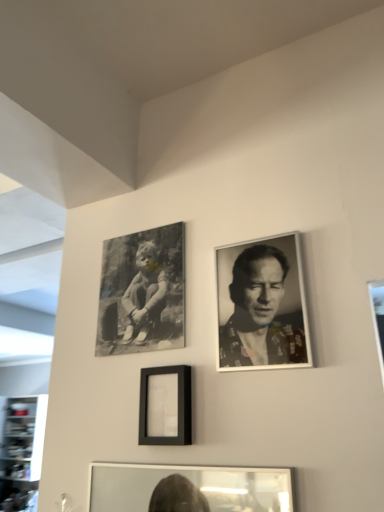
Measure the distance between point (x=122, y=298) and camera.

A distance of 1.21 meters exists between point (x=122, y=298) and camera.

What is the approximate width of black matte canvas at upper left, the 2th picture frame in the bottom-to-top sequence?

It is 1.17 inches.

You are a GUI agent. You are given a task and a screenshot of the screen. Output one action in this format:
    pyautogui.click(x=<x>, y=<y>)
    Task: Click on the black and white portrait at upper right
    
    Given the screenshot: What is the action you would take?
    pyautogui.click(x=259, y=313)

Could you measure the distance between black matte canvas at upper left, the 2th picture frame in the bottom-to-top sequence, and black and white portrait at upper right?

black matte canvas at upper left, the 2th picture frame in the bottom-to-top sequence, and black and white portrait at upper right are 9.85 inches apart.

Starting from the black and white portrait at upper right, which picture frame is the 2nd one to the left? Please provide its 2D coordinates.

[(142, 292)]

Consider the image. Is black matte canvas at upper left, the 2th picture frame in the bottom-to-top sequence, oriented towards black and white portrait at upper right?

No, black matte canvas at upper left, the 2th picture frame in the bottom-to-top sequence, is not aimed at black and white portrait at upper right.

From the image's perspective, is black matte canvas at upper left, the 2th picture frame in the bottom-to-top sequence, below black and white portrait at upper right?

Actually, black matte canvas at upper left, the 2th picture frame in the bottom-to-top sequence, appears above black and white portrait at upper right in the image.

Which picture frame is the 2nd one when counting from the back of the black and white portrait at upper right? Please provide its 2D coordinates.

[(142, 292)]

Is black and white portrait at upper right aimed at black matte canvas at upper left, the first picture frame in the back-to-front sequence?

No, black and white portrait at upper right is not oriented towards black matte canvas at upper left, the first picture frame in the back-to-front sequence.

In the scene shown: Can you tell me how much black and white portrait at upper right and black matte canvas at upper left, the 2th picture frame in the bottom-to-top sequence, differ in facing direction?

0.966 degrees.

Is black and white portrait at upper right with black matte canvas at upper left, the second picture frame viewed from the front?

No, black and white portrait at upper right is not with black matte canvas at upper left, the second picture frame viewed from the front.

Is matte black frame at center, the first picture frame positioned from the bottom, in contact with black and white portrait at upper right?

There is a gap between matte black frame at center, the first picture frame positioned from the bottom, and black and white portrait at upper right.

Is matte black frame at center, the first picture frame positioned from the bottom, aimed at black and white portrait at upper right?

No, matte black frame at center, the first picture frame positioned from the bottom, does not turn towards black and white portrait at upper right.

Does matte black frame at center, placed as the 2th picture frame when sorted from top to bottom, have a smaller size compared to black and white portrait at upper right?

Yes.

Find the location of a particular element. picture frame located above the matte black frame at center, the first picture frame when ordered from front to back (from the image's perspective) is located at coordinates (142, 292).

Looking at this image, between black matte canvas at upper left, the second picture frame viewed from the front, and matte black frame at center, the first picture frame positioned from the bottom, which one has more height?

black matte canvas at upper left, the second picture frame viewed from the front, is taller.

Is point (103, 246) farther from camera compared to point (178, 434)?

Yes, point (103, 246) is farther from viewer.

From the image's perspective, between black matte canvas at upper left, which appears as the 1th picture frame when viewed from the top, and matte black frame at center, the first picture frame when ordered from front to back, who is located below?

From the image's view, matte black frame at center, the first picture frame when ordered from front to back, is below.

Could you tell me if black and white portrait at upper right is facing matte black frame at center, the first picture frame positioned from the bottom?

No, black and white portrait at upper right is not facing towards matte black frame at center, the first picture frame positioned from the bottom.

How far apart are black and white portrait at upper right and matte black frame at center, the first picture frame when ordered from front to back?

The distance of black and white portrait at upper right from matte black frame at center, the first picture frame when ordered from front to back, is 8.61 inches.

In terms of size, does black and white portrait at upper right appear bigger or smaller than matte black frame at center, the first picture frame when ordered from front to back?

In the image, black and white portrait at upper right appears to be larger than matte black frame at center, the first picture frame when ordered from front to back.

From the picture: From a real-world perspective, which object rests below the other?

In real-world perspective, matte black frame at center, the first picture frame when ordered from front to back, is lower.

From the image's perspective, which one is positioned lower, matte black frame at center, the first picture frame when ordered from front to back, or black matte canvas at upper left, which appears as the 1th picture frame when viewed from the top?

matte black frame at center, the first picture frame when ordered from front to back, from the image's perspective.

From a real-world perspective, between matte black frame at center, the first picture frame when ordered from front to back, and black matte canvas at upper left, the 2th picture frame in the bottom-to-top sequence, who is vertically higher?

black matte canvas at upper left, the 2th picture frame in the bottom-to-top sequence, is physically above.

Is matte black frame at center, arranged as the second picture frame when viewed from the back, in front of or behind black matte canvas at upper left, the first picture frame in the back-to-front sequence, in the image?

matte black frame at center, arranged as the second picture frame when viewed from the back, is in front of black matte canvas at upper left, the first picture frame in the back-to-front sequence.

The height and width of the screenshot is (512, 384). In order to click on man below the black matte canvas at upper left, the 2th picture frame in the bottom-to-top sequence (from the image's perspective) in this screenshot , I will do `click(259, 313)`.

From the black and white portrait at upper right, count the 2nd picture frame to the left and point to it. Please provide its 2D coordinates.

[(142, 292)]

From the image, which object appears to be farther from black and white portrait at upper right, matte black frame at center, arranged as the second picture frame when viewed from the back, or black matte canvas at upper left, the second picture frame viewed from the front?

Among the two, black matte canvas at upper left, the second picture frame viewed from the front, is located further to black and white portrait at upper right.

Looking at the image, which one is located further to black and white portrait at upper right, black matte canvas at upper left, the 2th picture frame in the bottom-to-top sequence, or matte black frame at center, the first picture frame when ordered from front to back?

black matte canvas at upper left, the 2th picture frame in the bottom-to-top sequence.

Consider the image. Estimate the real-world distances between objects in this image. Which object is further from black matte canvas at upper left, the first picture frame in the back-to-front sequence, matte black frame at center, placed as the 2th picture frame when sorted from top to bottom, or black and white portrait at upper right?

black and white portrait at upper right.

From the image, which object appears to be farther from matte black frame at center, arranged as the second picture frame when viewed from the back, black matte canvas at upper left, the 2th picture frame in the bottom-to-top sequence, or black and white portrait at upper right?

black matte canvas at upper left, the 2th picture frame in the bottom-to-top sequence, is positioned further to the anchor matte black frame at center, arranged as the second picture frame when viewed from the back.

Based on the photo, considering their positions, is black and white portrait at upper right positioned further to black matte canvas at upper left, the 2th picture frame in the bottom-to-top sequence, than matte black frame at center, the first picture frame when ordered from front to back?

Among the two, black and white portrait at upper right is located further to black matte canvas at upper left, the 2th picture frame in the bottom-to-top sequence.

Considering their positions, is black and white portrait at upper right positioned closer to matte black frame at center, the first picture frame positioned from the bottom, than black matte canvas at upper left, which appears as the 1th picture frame when viewed from the top?

Based on the image, black and white portrait at upper right appears to be nearer to matte black frame at center, the first picture frame positioned from the bottom.

Identify the location of picture frame located between black matte canvas at upper left, which appears as the 1th picture frame when viewed from the top, and black and white portrait at upper right in the left-right direction. The image size is (384, 512). (177, 406).